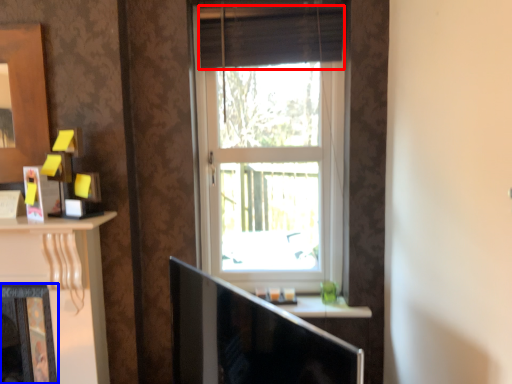
Question: Which point is closer to the camera, curtain (highlighted by a red box) or fireplace (highlighted by a blue box)?

Choices:
 (A) curtain
 (B) fireplace

Answer: (B)